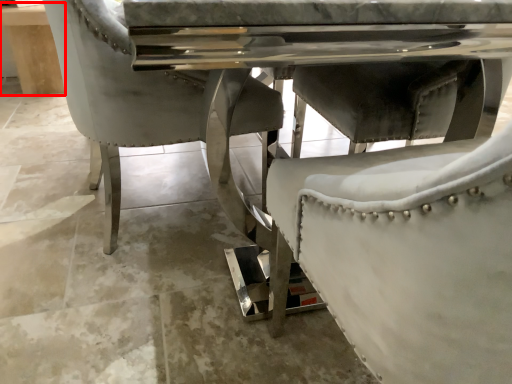
Question: From the image's perspective, where is table (annotated by the red box) located relative to concrete?

Choices:
 (A) below
 (B) above

Answer: (B)